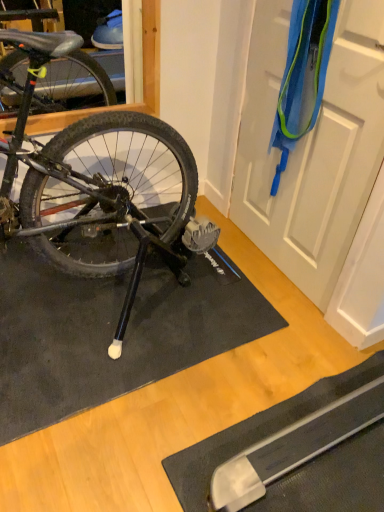
This screenshot has height=512, width=384. Identify the location of vacant region above black rubber doormat at lower left (from a real-world perspective). (132, 313).